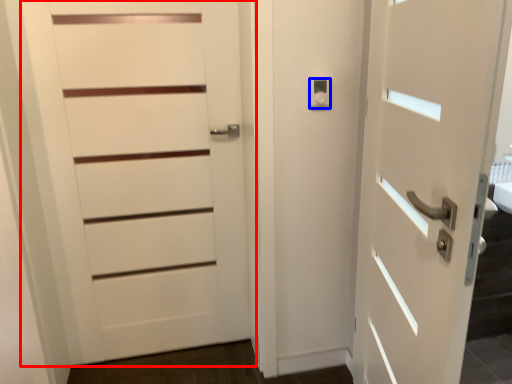
Question: Which point is closer to the camera, door (highlighted by a red box) or knob (highlighted by a blue box)?

Choices:
 (A) door
 (B) knob

Answer: (A)